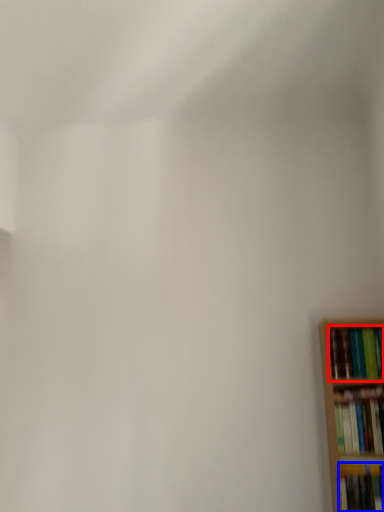
Question: Which object appears farthest to the camera in this image, book (highlighted by a red box) or book (highlighted by a blue box)?

Choices:
 (A) book
 (B) book

Answer: (A)